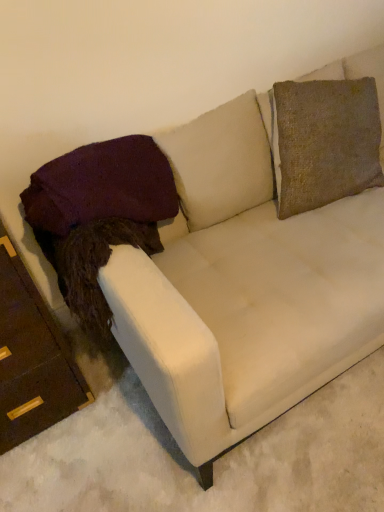
Image resolution: width=384 pixels, height=512 pixels. I want to click on vacant area that is situated to the right of dark wood dresser at lower left, so click(116, 401).